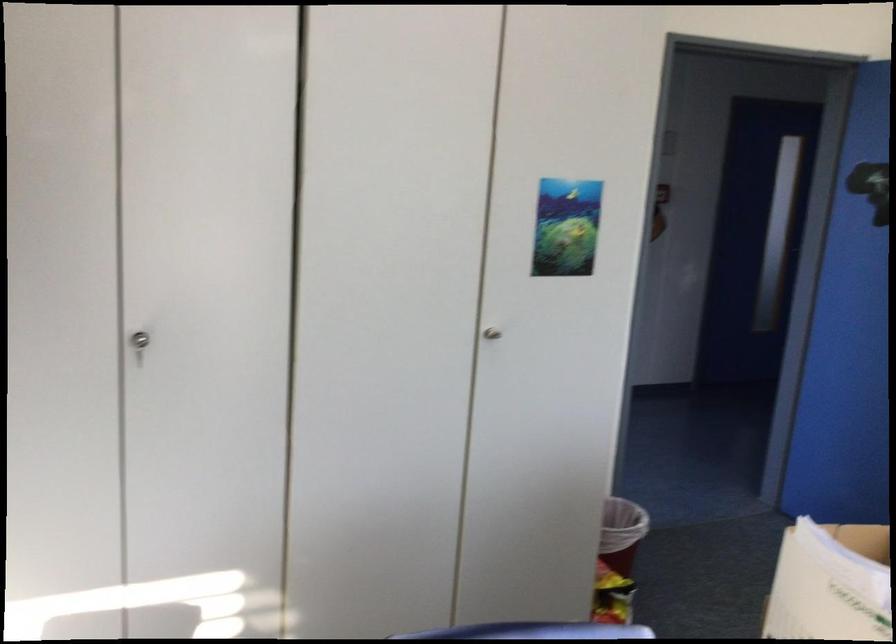
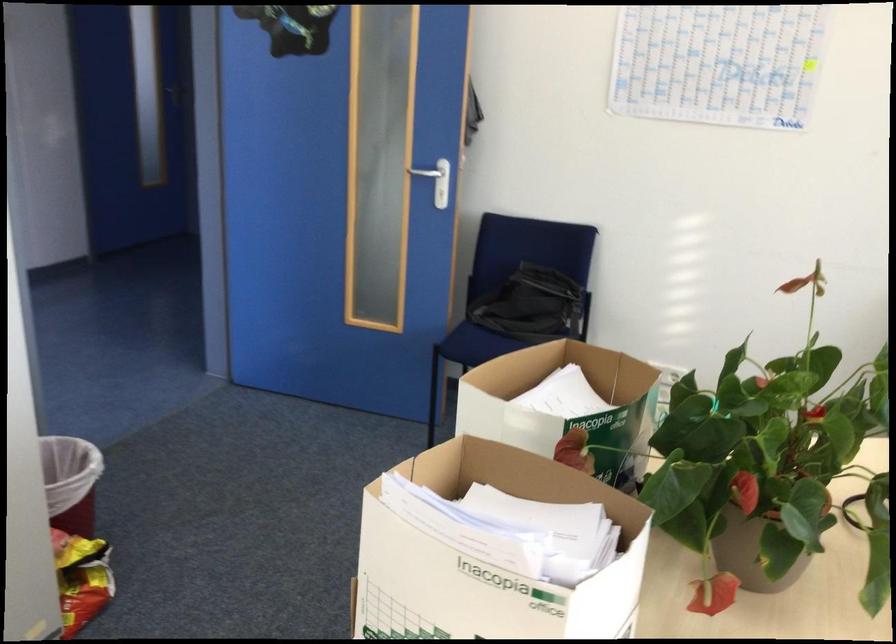
Question: The camera is either moving clockwise (left) or counter-clockwise (right) around the object. The first image is from the beginning of the video and the second image is from the end. Is the camera moving left or right when shooting the video?

Choices:
 (A) Left
 (B) Right

Answer: (A)